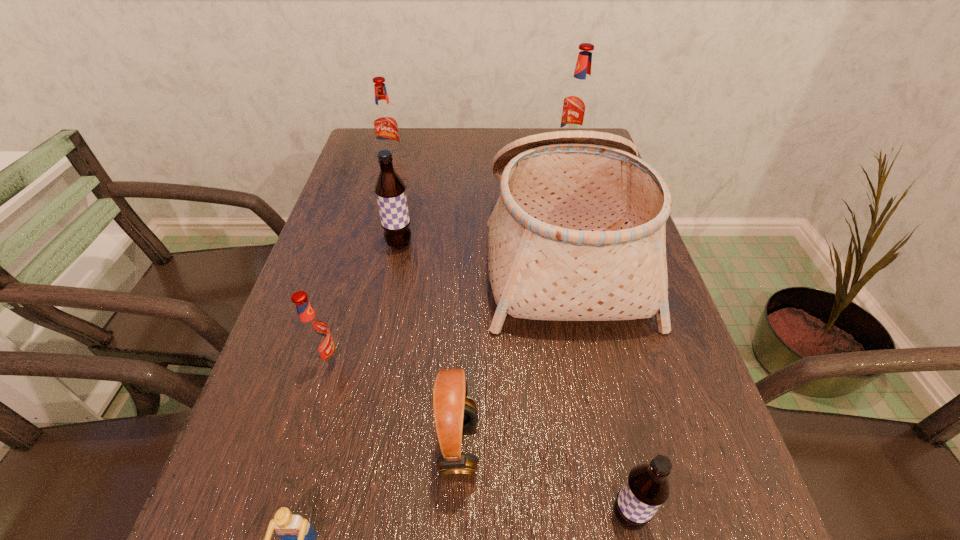
Where is `brown headset`? This screenshot has height=540, width=960. brown headset is located at coordinates (454, 412).

Where is `the fifth object from left to right`? This screenshot has height=540, width=960. the fifth object from left to right is located at coordinates (454, 412).

The width and height of the screenshot is (960, 540). In order to click on free region located on the front of the biggest red root beer in this screenshot , I will do `click(584, 192)`.

Where is `free region located 0.340m with the lid open on the basket`? free region located 0.340m with the lid open on the basket is located at coordinates (341, 251).

This screenshot has height=540, width=960. Find the location of `vacant space located with the lid open on the basket`. vacant space located with the lid open on the basket is located at coordinates (419, 251).

Identify the location of vacant region located with the lid open on the basket. (372, 251).

Where is `vacant space located 0.230m on the front of the second biggest red root beer`? The height and width of the screenshot is (540, 960). vacant space located 0.230m on the front of the second biggest red root beer is located at coordinates (376, 212).

In order to click on vacant area situated 0.220m on the front of the third root beer from left to right in this screenshot , I will do `click(383, 328)`.

Locate an element on the screen. The width and height of the screenshot is (960, 540). blank space located 0.050m on the front of the nearest red root beer is located at coordinates (315, 398).

This screenshot has width=960, height=540. In order to click on vacant space located on the left of the smaller brown root beer in this screenshot , I will do pos(385,517).